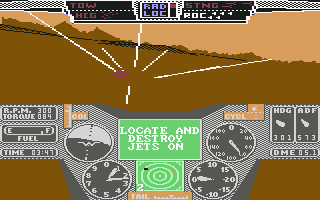
Locate an element on the screen. This screenshot has width=320, height=200. clock is located at coordinates 44,152.